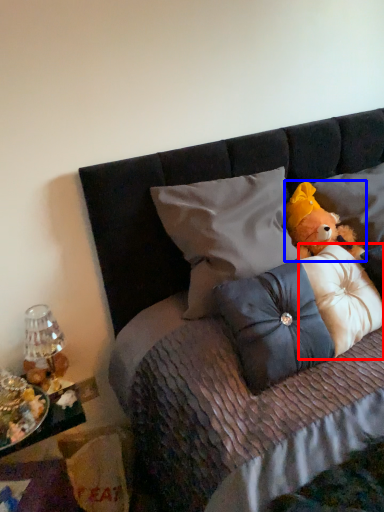
Question: Which of the following is the closest to the observer, pillow (highlighted by a red box) or teddy bear (highlighted by a blue box)?

Choices:
 (A) pillow
 (B) teddy bear

Answer: (A)